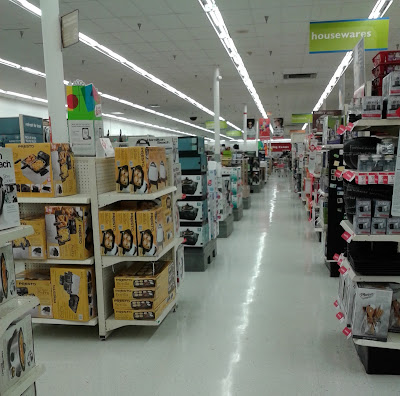
The width and height of the screenshot is (400, 396). Find the location of `frying pan with lid in box`. frying pan with lid in box is located at coordinates (146, 239).